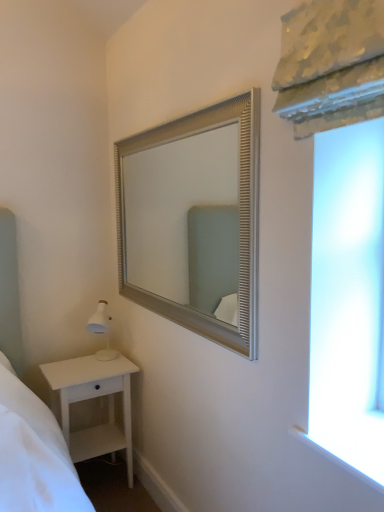
At what (x,y) coordinates should I click in order to perform the action: click on free spot above white matte nightstand at lower left (from a real-world perspective). Please return your answer as a coordinate pair (x, y). The height and width of the screenshot is (512, 384). Looking at the image, I should click on (97, 364).